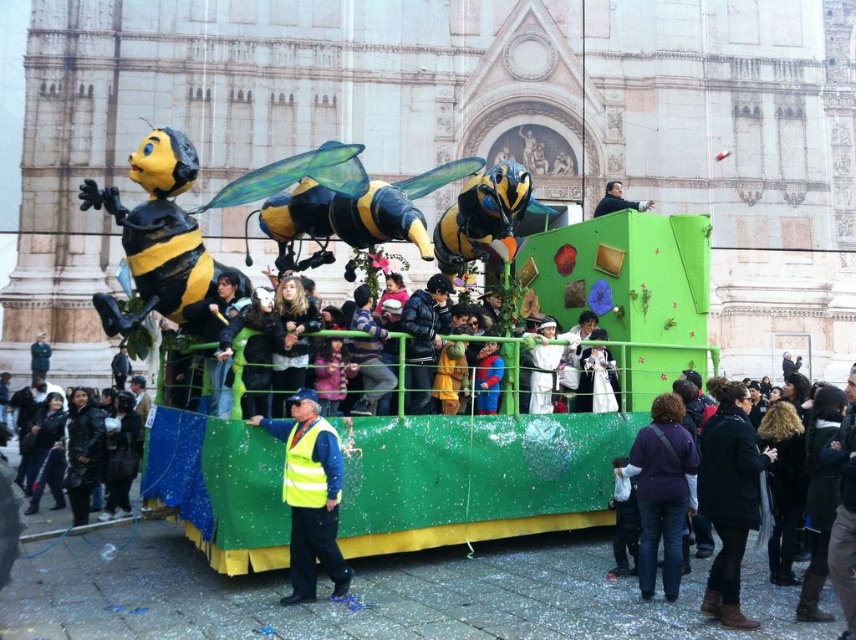
Question: Which object appears farthest from the camera in this image?

Choices:
 (A) yellow reflective vest at center
 (B) purple fabric jacket at lower right
 (C) black wool coat at lower right
 (D) dark blue jacket at center

Answer: (D)

Question: Which point is closer to the camera taking this photo?

Choices:
 (A) (37, 336)
 (B) (129, 512)

Answer: (B)

Question: Considering the real-world distances, which object is farthest from the purple fabric jacket at lower right?

Choices:
 (A) black wool coat at lower right
 (B) matte black jacket at center

Answer: (B)

Question: Does black leather jacket at lower left have a lesser width compared to matte black jacket at upper right?

Choices:
 (A) yes
 (B) no

Answer: (B)

Question: Is the position of black leather jacket at lower left less distant than that of matte black jacket at upper right?

Choices:
 (A) yes
 (B) no

Answer: (A)

Question: Is the position of black wool coat at lower right less distant than that of dark blue jacket at center?

Choices:
 (A) yes
 (B) no

Answer: (A)